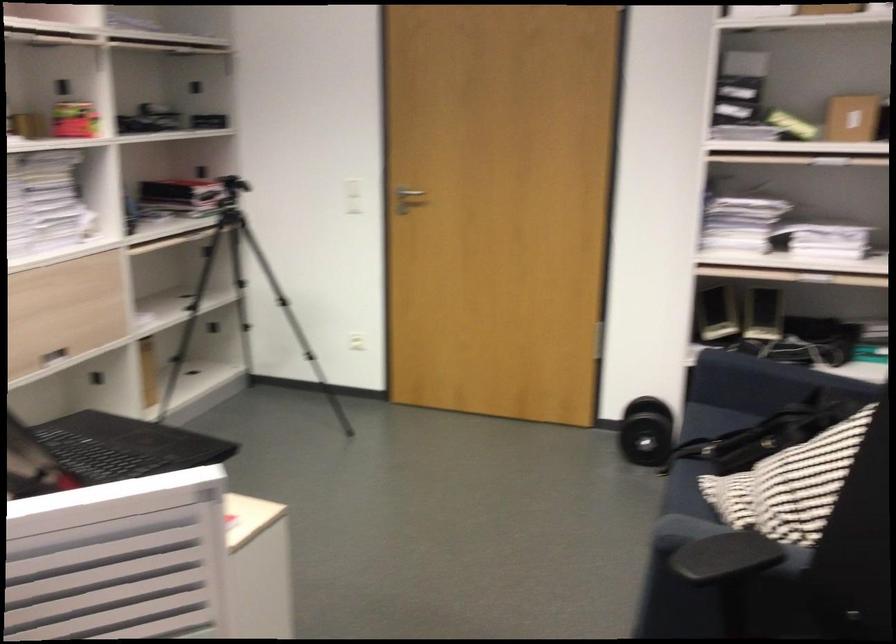
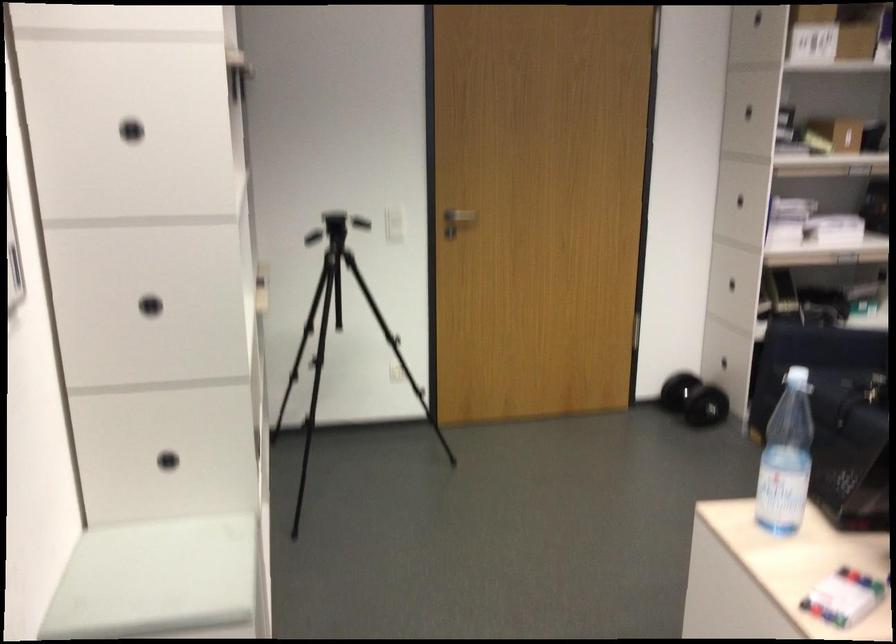
Where in the second image is the point corresponding to (x=737, y=82) from the first image?

(747, 111)